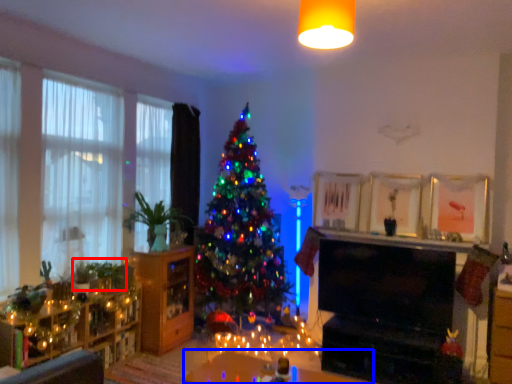
Question: Which point is further to the camera, plant (highlighted by a red box) or table (highlighted by a blue box)?

Choices:
 (A) plant
 (B) table

Answer: (A)